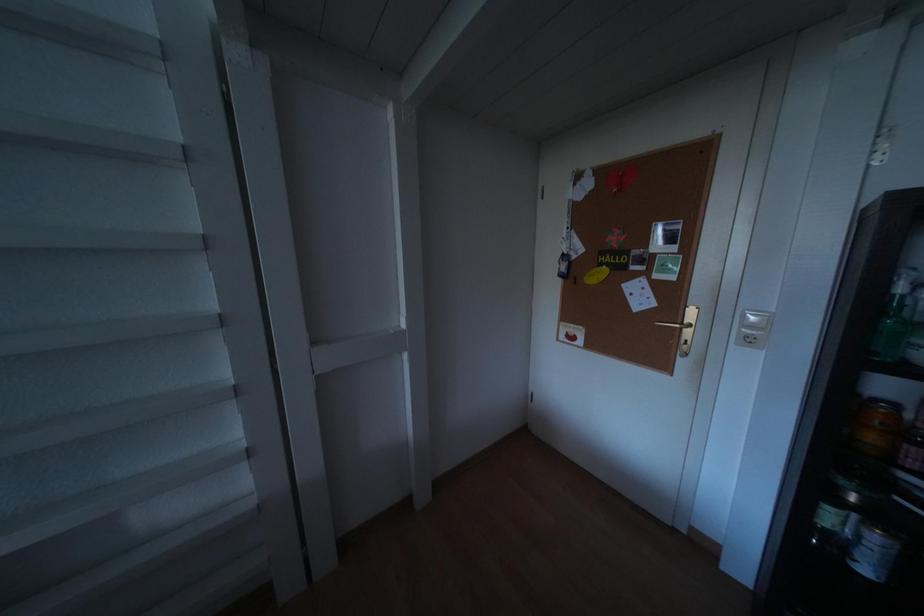
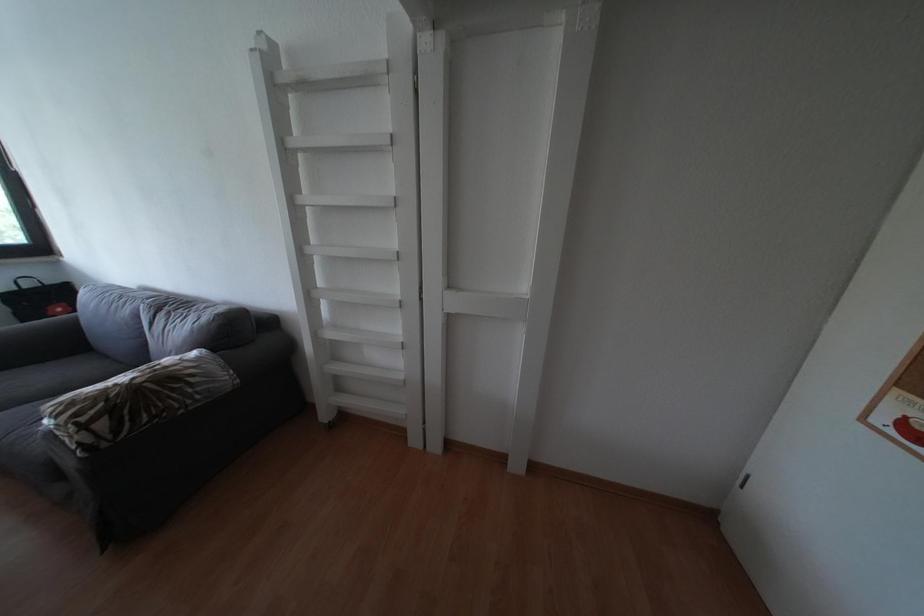
Question: How did the camera likely rotate?

Choices:
 (A) Left
 (B) Right
 (C) Up
 (D) Down

Answer: (A)